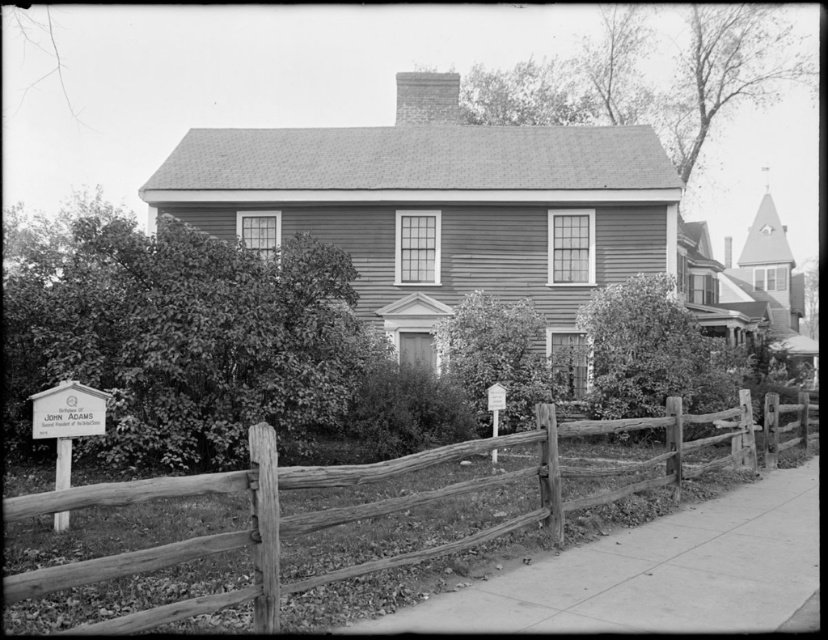
How much distance is there between wooden at lower left and white wood sign at lower left?

The distance of wooden at lower left from white wood sign at lower left is 4.68 meters.

Does wooden at lower left appear on the right side of white wood sign at lower left?

Indeed, wooden at lower left is positioned on the right side of white wood sign at lower left.

Which is behind, point (135, 560) or point (90, 396)?

Positioned behind is point (90, 396).

What are the coordinates of `wooden at lower left` in the screenshot? It's located at 355,508.